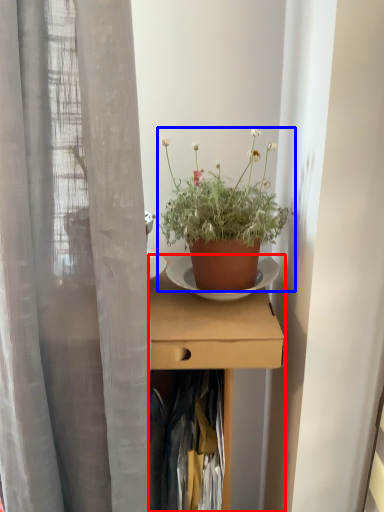
Question: Which point is closer to the camera, desk (highlighted by a red box) or houseplant (highlighted by a blue box)?

Choices:
 (A) desk
 (B) houseplant

Answer: (A)